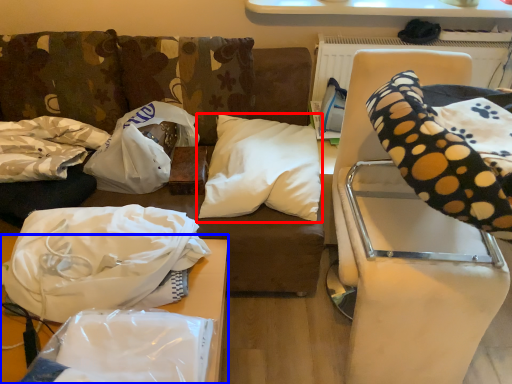
Question: Among these objects, which one is nearest to the camera, pillow (highlighted by a red box) or furniture (highlighted by a blue box)?

Choices:
 (A) pillow
 (B) furniture

Answer: (B)